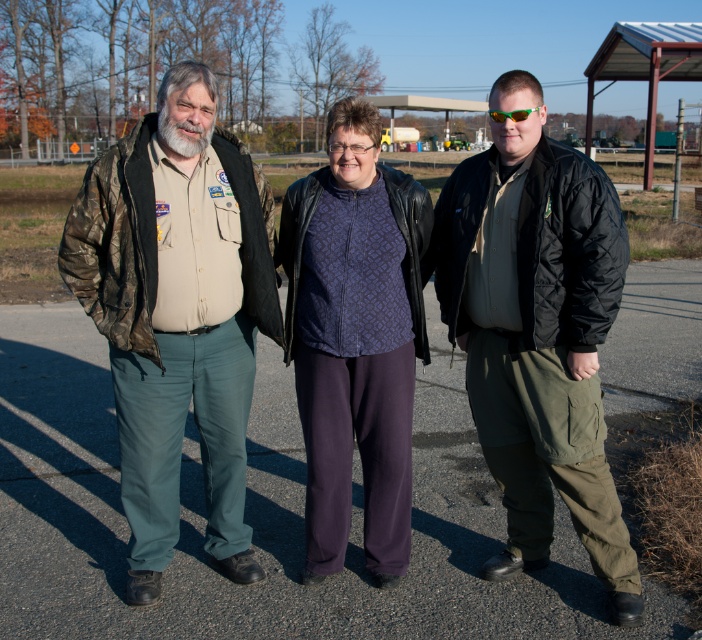
You are standing on the paved area and want to place a small potted plant exactly where the dark gray asphalt at center is located. Is that possible?

Yes, you can place the potted plant at the dark gray asphalt at center because it is located at coordinates point (258, 515).

You are a delivery robot with a width of 1.2 meters. You need to move from your current position near the camo jacket at left to the dark gray asphalt at center. Can you pass through the space between them without any obstacles?

The distance between the camo jacket at left and the dark gray asphalt at center is 1.54 meters. Since the robot is 1.2 meters wide, it can pass through the space as the distance is wider than the robot.